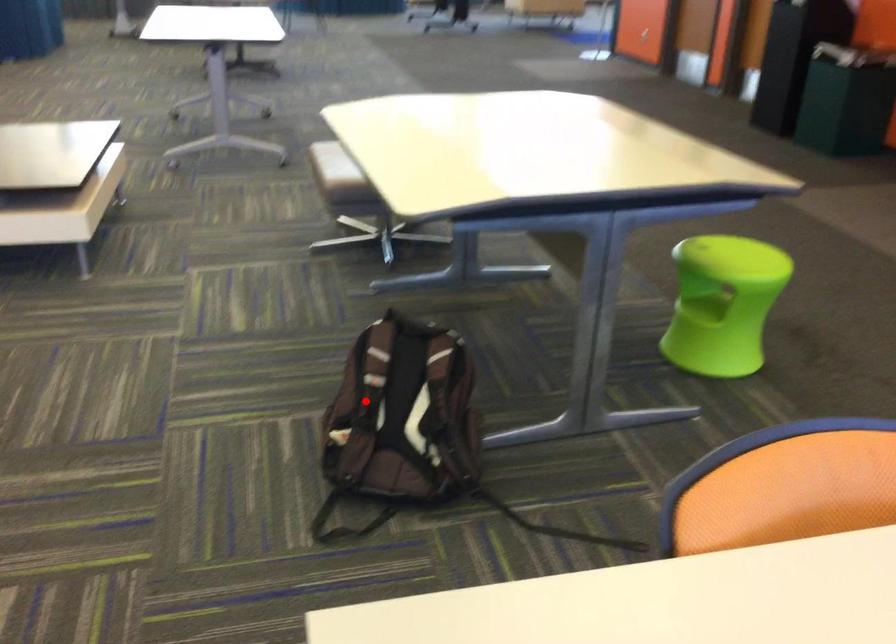
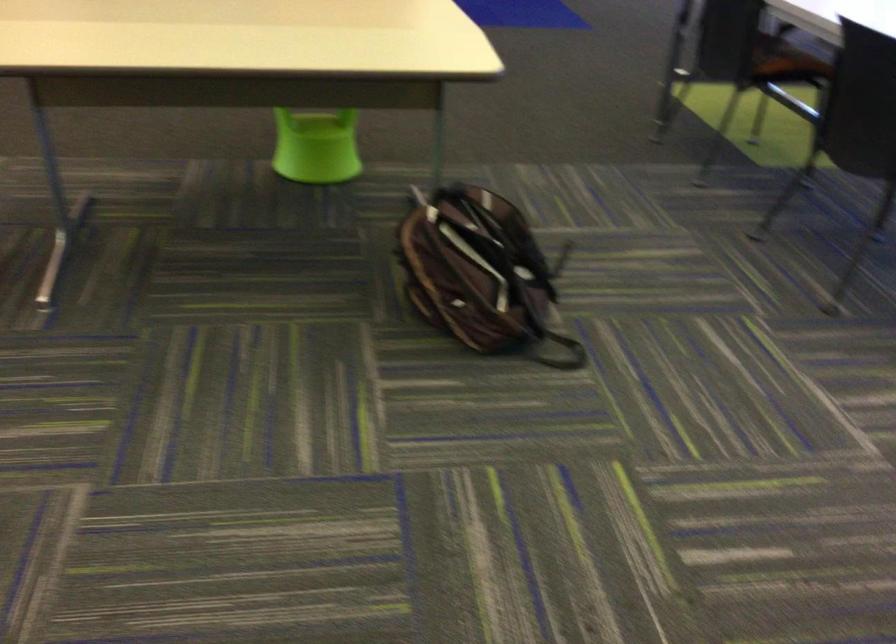
Find the pixel in the second image that matches the highlighted location in the first image.

(479, 272)